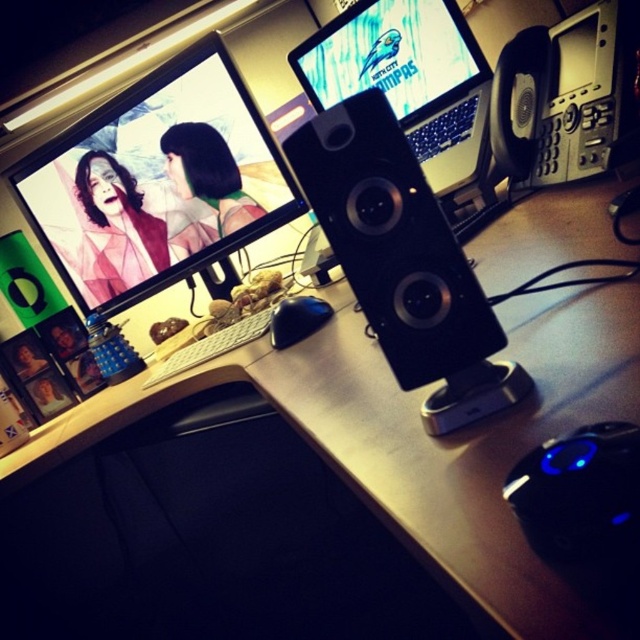
You are setting up a new monitor on your desk and need to place it near the matte plastic laptop at upper center. Based on the coordinates provided, where should you position the new monitor relative to the laptop?

The matte plastic laptop at upper center is located at coordinates point (392, 56), so you should position the new monitor near that point.

You need to place a new wireless charger that requires 15 cm of space. You have two options on the desk between the monitors where the matte plastic laptop at upper center and the black matte mouse at center are located. Which object should you place it next to to ensure enough space?

The matte plastic laptop at upper center is bigger than the black matte mouse at center, so placing the wireless charger next to the black matte mouse at center would provide sufficient space since it is smaller and requires less area.